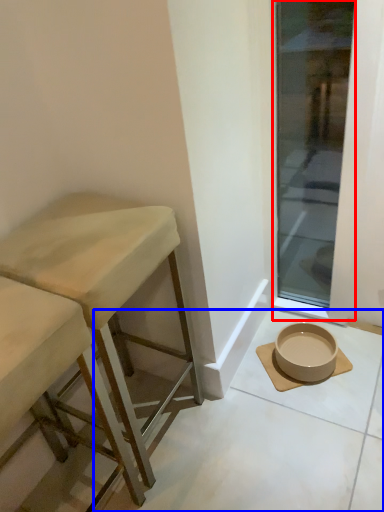
Question: Which object is closer to the camera taking this photo, window (highlighted by a red box) or concrete (highlighted by a blue box)?

Choices:
 (A) window
 (B) concrete

Answer: (B)